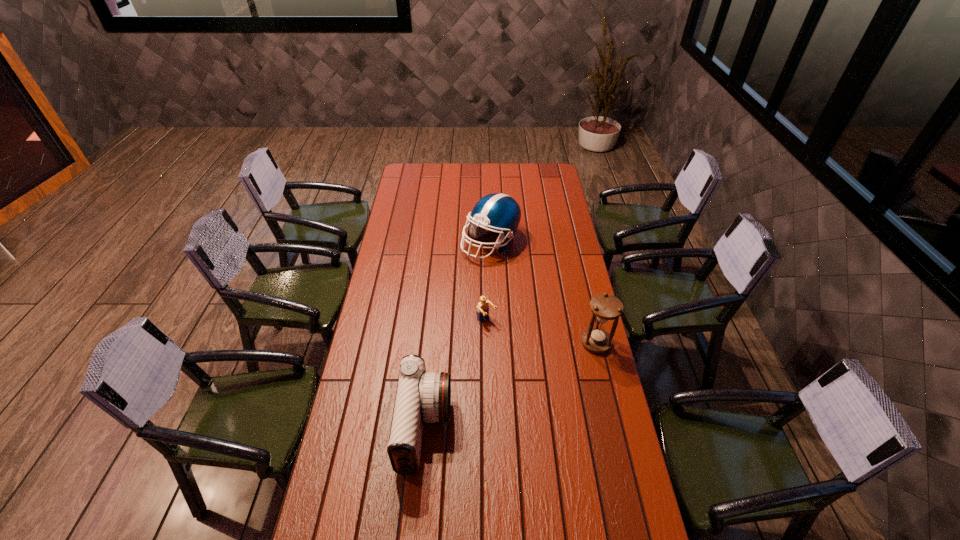
I want to click on the leftmost object, so click(x=421, y=397).

You are a GUI agent. You are given a task and a screenshot of the screen. Output one action in this format:
    pyautogui.click(x=<x>, y=<y>)
    Task: Click on the camcorder
    This screenshot has height=540, width=960.
    Given the screenshot: What is the action you would take?
    pyautogui.click(x=421, y=397)

The image size is (960, 540). What are the coordinates of `hourglass` in the screenshot? It's located at (606, 307).

Locate an element on the screen. This screenshot has width=960, height=540. the rightmost object is located at coordinates (606, 307).

In order to click on the shortest object in this screenshot , I will do `click(483, 308)`.

What are the coordinates of `Lego` in the screenshot? It's located at (483, 308).

Image resolution: width=960 pixels, height=540 pixels. I want to click on the farthest object, so click(x=500, y=213).

Find the location of a particular element. vacant space located on the surface of the camcorder is located at coordinates (538, 428).

At what (x,y) coordinates should I click in order to perform the action: click on vacant position located 0.170m on the front of the rightmost object. Please return your answer as a coordinate pair (x, y). The image size is (960, 540). Looking at the image, I should click on (609, 395).

In order to click on free space located 0.400m on the face of the shortest object in this screenshot , I will do `click(564, 399)`.